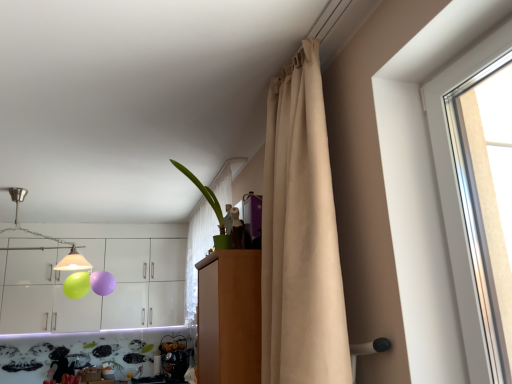
Question: From the image's perspective, is beige fabric curtain at upper right positioned above or below brushed metal lampshade at upper left?

Choices:
 (A) above
 (B) below

Answer: (A)

Question: In terms of size, does beige fabric curtain at upper right appear bigger or smaller than brushed metal lampshade at upper left?

Choices:
 (A) big
 (B) small

Answer: (A)

Question: Considering the real-world distances, which object is farthest from the brushed metal lampshade at upper left?

Choices:
 (A) wooden cabinet at center
 (B) green matte plant at upper center
 (C) white glossy cabinets at upper left
 (D) beige fabric curtain at upper right

Answer: (D)

Question: Which is nearer to the beige fabric curtain at upper right?

Choices:
 (A) wooden cabinet at center
 (B) white glossy cabinets at upper left
 (C) brushed metal lampshade at upper left
 (D) green matte plant at upper center

Answer: (A)